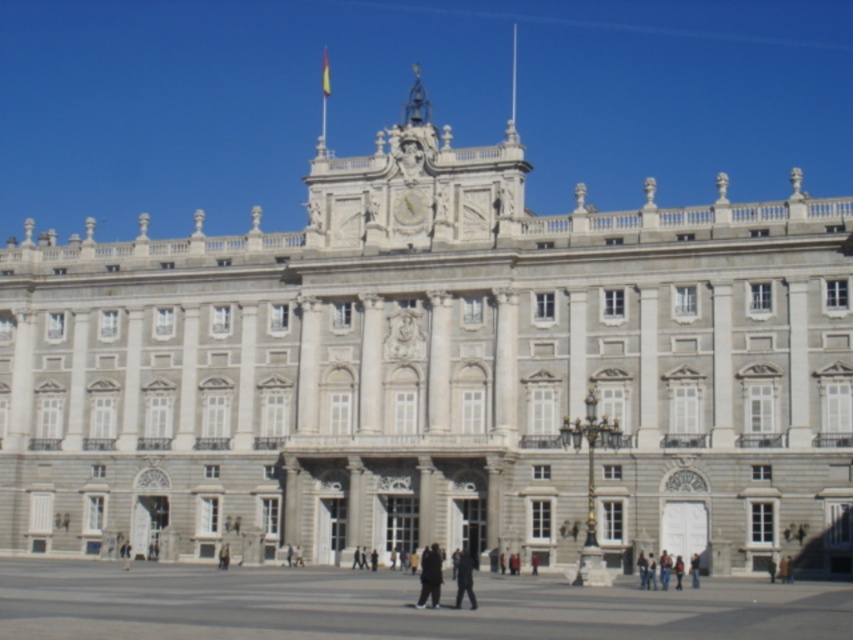
Question: From the image, what is the correct spatial relationship of dark gray fabric pants at center in relation to dark gray uniform at center?

Choices:
 (A) left
 (B) right

Answer: (A)

Question: Can you confirm if dark gray uniform at center is positioned above dark gray jacket at center?

Choices:
 (A) no
 (B) yes

Answer: (B)

Question: Which object appears farthest from the camera in this image?

Choices:
 (A) dark gray uniform at center
 (B) dark gray jacket at center

Answer: (B)

Question: Which point is closer to the camera?

Choices:
 (A) (428, 566)
 (B) (457, 580)
 (C) (521, 589)

Answer: (B)

Question: From the image, what is the correct spatial relationship of dark gray fabric pants at center in relation to dark gray jacket at center?

Choices:
 (A) above
 (B) below

Answer: (A)

Question: Which object appears closest to the camera in this image?

Choices:
 (A) dark gray uniform at center
 (B) dark gray fabric pants at center
 (C) dark gray jacket at center

Answer: (A)